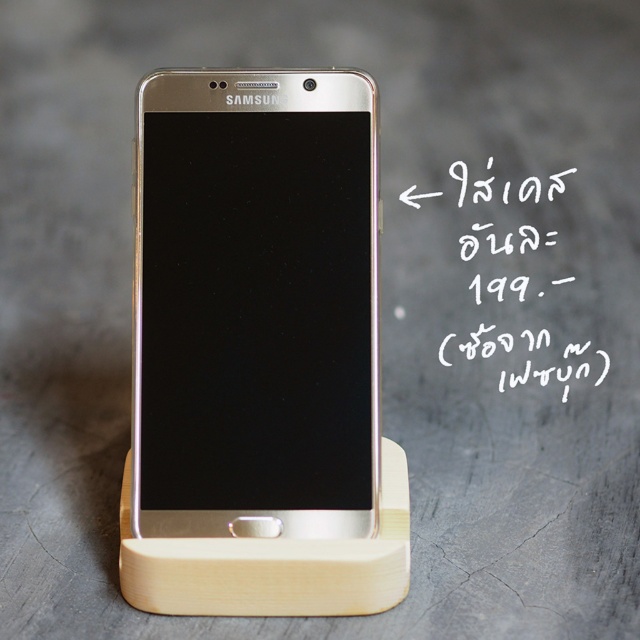
Between point (330, 166) and point (476, 186), which one is positioned behind?

Point (476, 186)

Measure the distance between silver metallic smartphone at center and camera.

silver metallic smartphone at center and camera are 3.78 feet apart.

The height and width of the screenshot is (640, 640). I want to click on silver metallic smartphone at center, so click(257, 305).